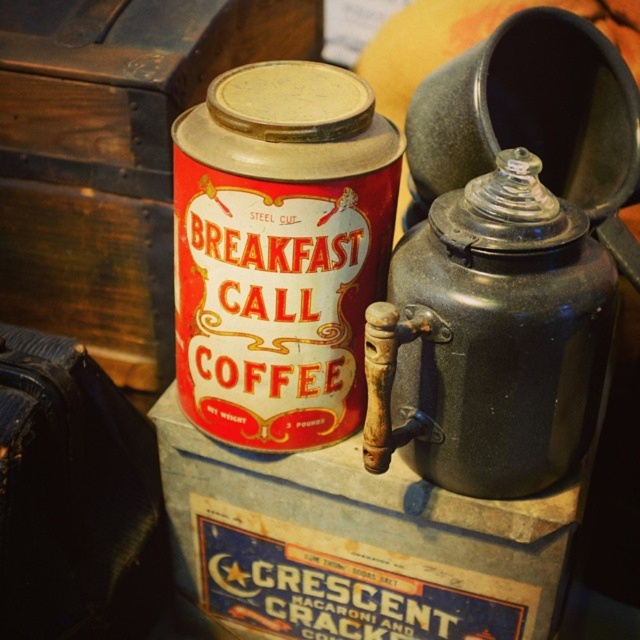
Looking at this image, can you confirm if red matte tin can at center is positioned below matte black teapot at center right?

No, red matte tin can at center is not below matte black teapot at center right.

Which is behind, point (342, 122) or point (394, 401)?

The point (394, 401) is more distant.

What are the coordinates of `red matte tin can at center` in the screenshot? It's located at (280, 252).